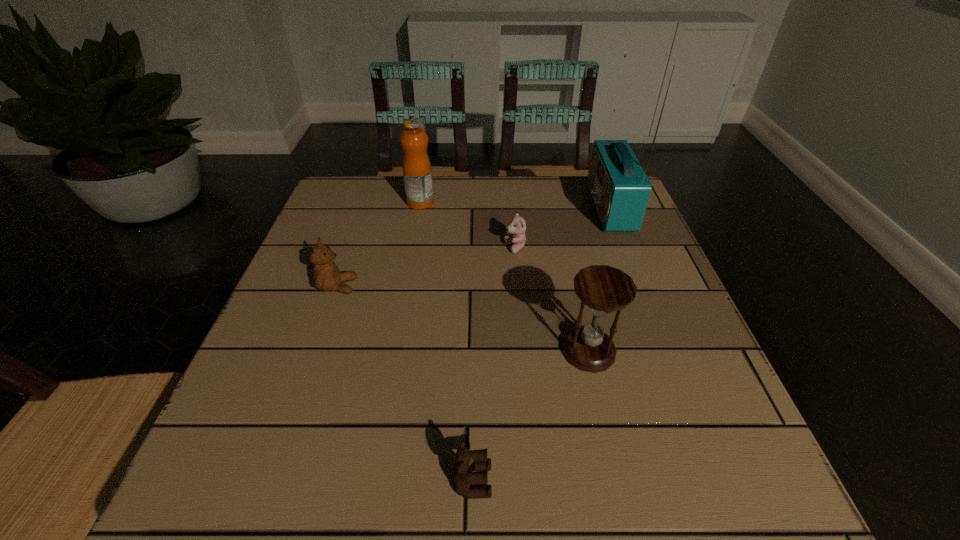
The height and width of the screenshot is (540, 960). I want to click on vacant space at the near edge of the desktop, so click(x=588, y=469).

You are a GUI agent. You are given a task and a screenshot of the screen. Output one action in this format:
    pyautogui.click(x=<x>, y=<y>)
    Task: Click on the vacant space at the left edge of the desktop
    This screenshot has height=540, width=960.
    Given the screenshot: What is the action you would take?
    pyautogui.click(x=326, y=398)

Image resolution: width=960 pixels, height=540 pixels. What are the coordinates of `blank space at the right edge of the desktop` in the screenshot? It's located at (626, 243).

I want to click on free location at the far right corner, so click(583, 183).

In the image, there is a desktop. Where is `free space at the near right corner`? The height and width of the screenshot is (540, 960). free space at the near right corner is located at coordinates (708, 483).

I want to click on free point between the fourth nearest object and the fruit juice, so click(468, 225).

At what (x,y) coordinates should I click in order to perform the action: click on vacant area that lies between the tallest object and the fourth object from left to right. Please return your answer as a coordinate pair (x, y). Looking at the image, I should click on (563, 227).

Find the location of a particular element. The image size is (960, 540). vacant area that lies between the second farthest teddy bear and the rightmost teddy bear is located at coordinates (426, 267).

The width and height of the screenshot is (960, 540). Find the location of `empty location between the second nearest object and the fourth nearest object`. empty location between the second nearest object and the fourth nearest object is located at coordinates (552, 299).

Find the location of a particular element. The height and width of the screenshot is (540, 960). free spot between the fourth object from left to right and the tallest object is located at coordinates pos(563,227).